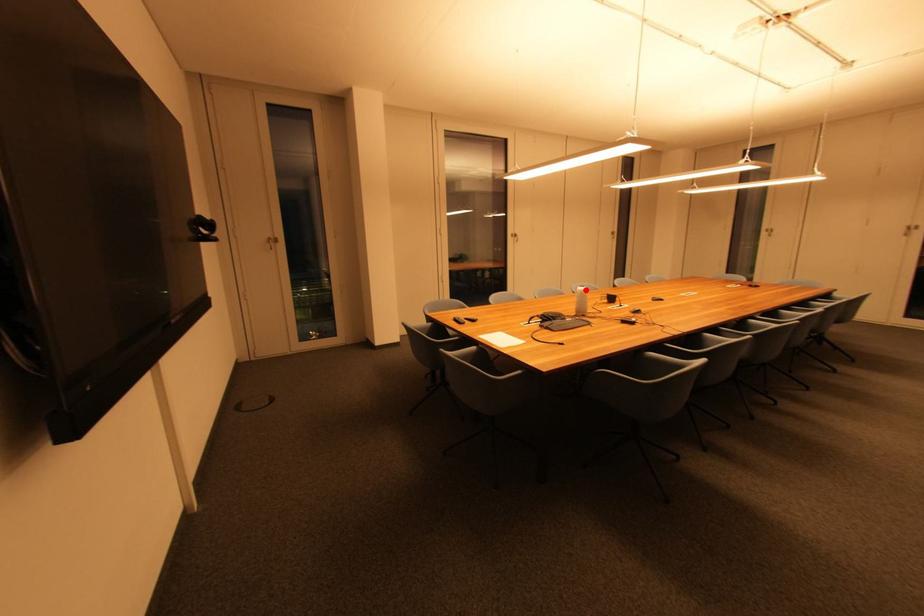
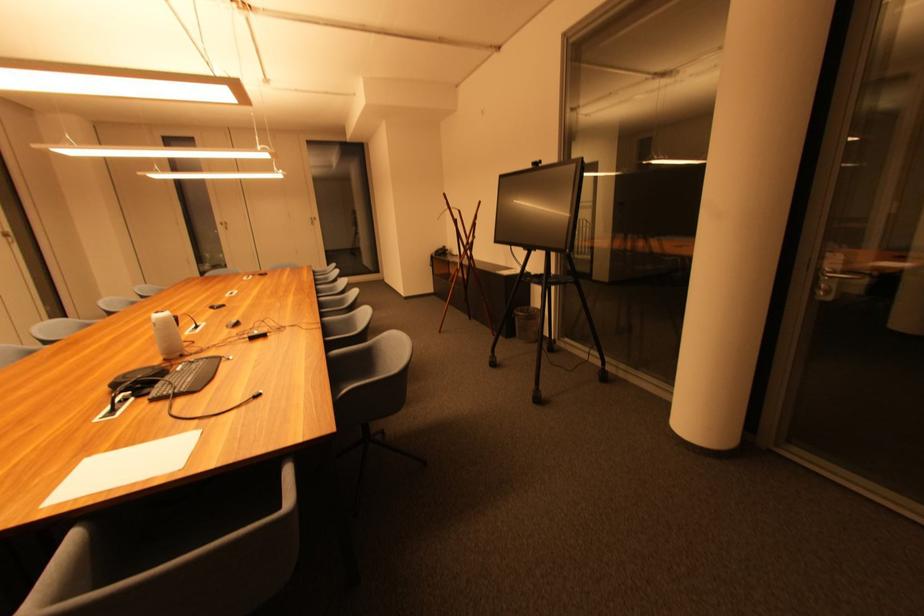
Where in the second image is the point corresponding to the highlighted location from the first image?

(160, 318)